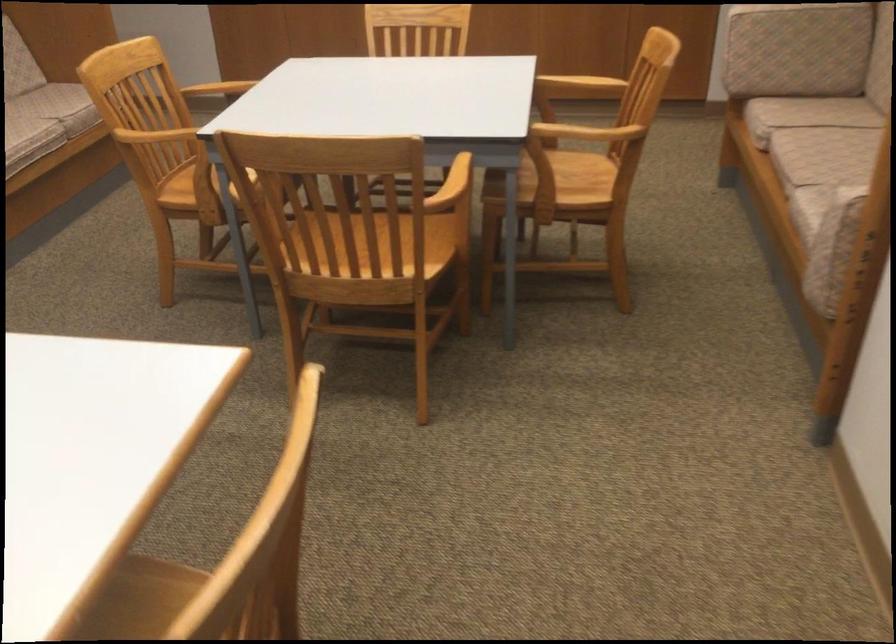
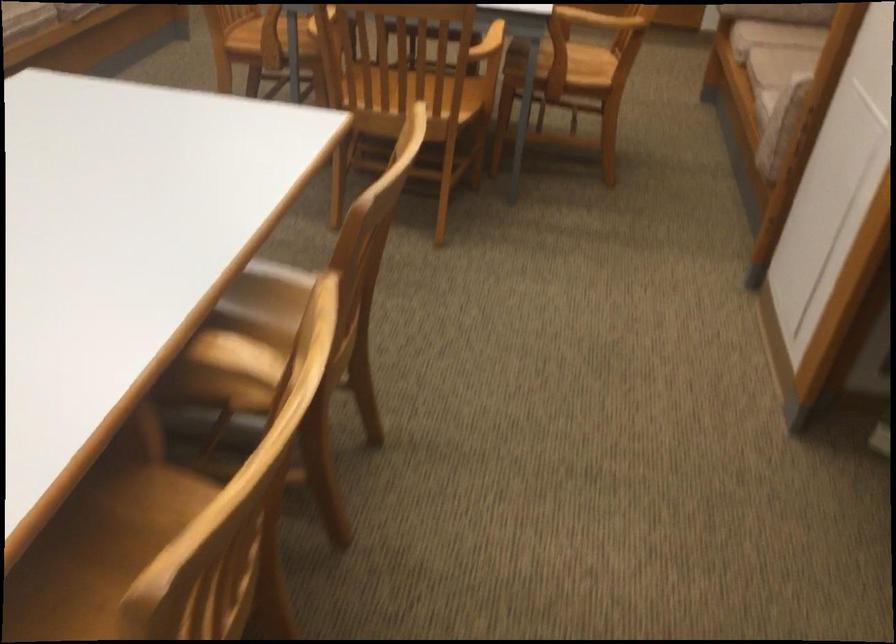
Where in the second image is the point corresponding to point 805,111 from the first image?

(782, 33)